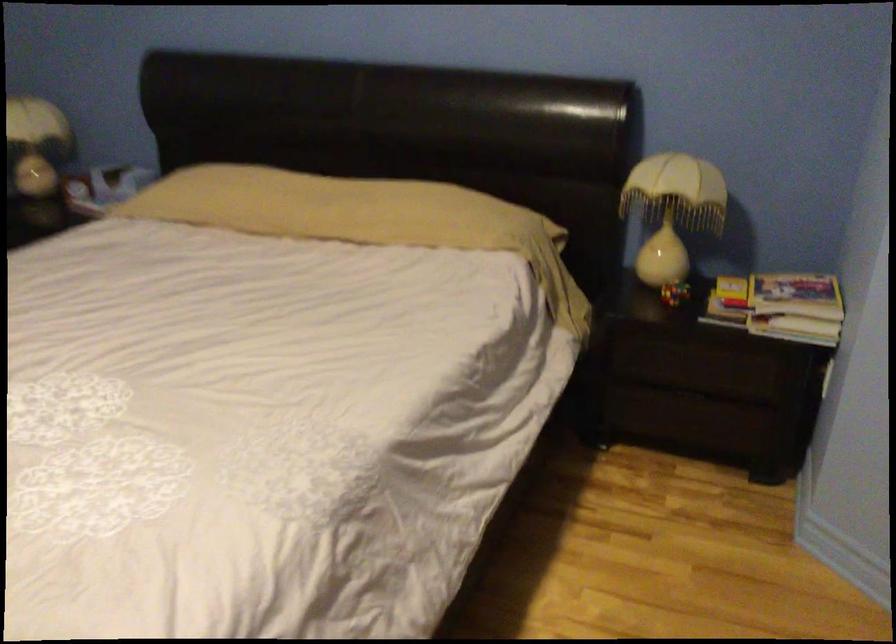
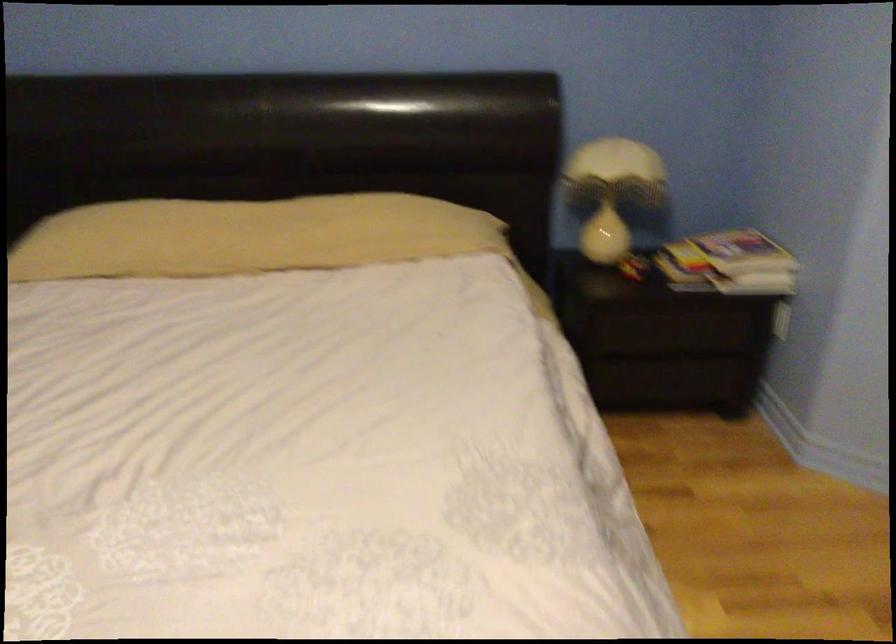
Question: The images are taken continuously from a first-person perspective. In which direction are you moving?

Choices:
 (A) Left
 (B) Right
 (C) Forward
 (D) Backward

Answer: (A)